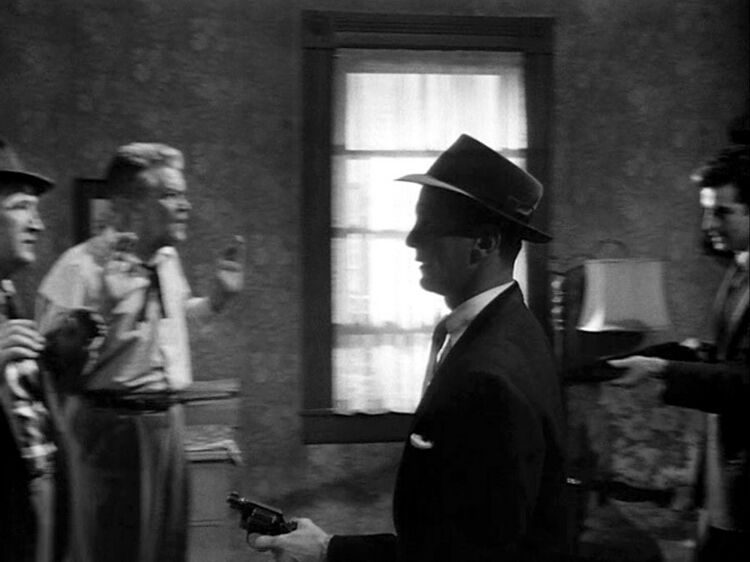
Where is `wall`? This screenshot has height=562, width=750. wall is located at coordinates (260, 312).